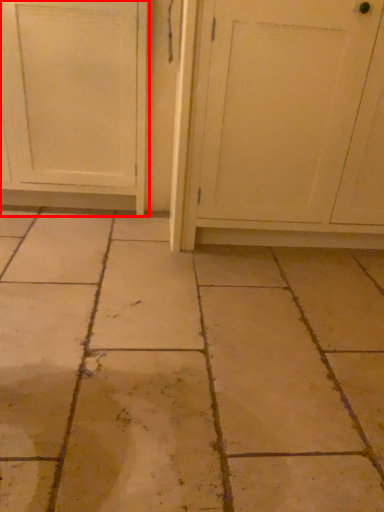
Question: From the image's perspective, where is door (annotated by the red box) located in relation to screen door in the image?

Choices:
 (A) above
 (B) below

Answer: (A)